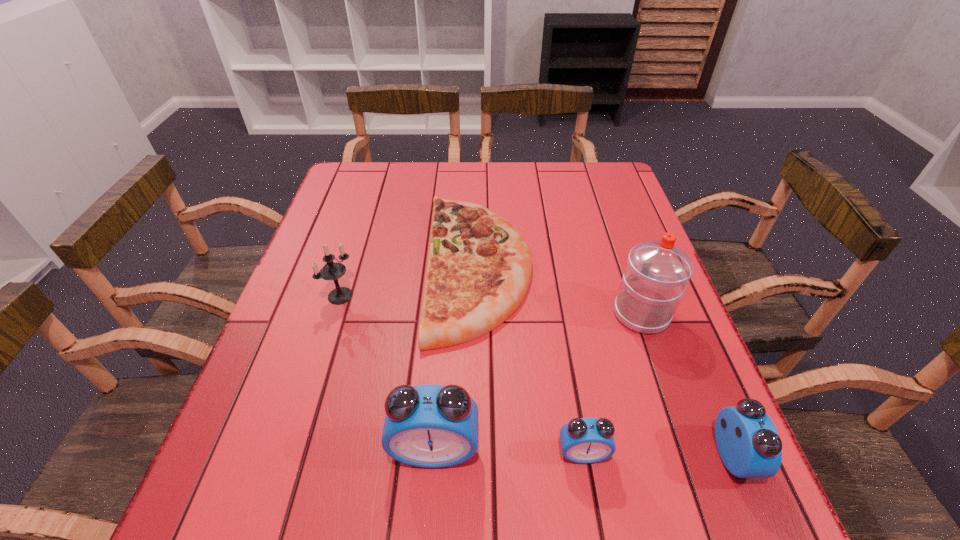
Given the evenly spaced alarm clocks in the image, where should an extra alarm clock be added on the left to preserve the spacing? Please point to a vacant space. Please provide its 2D coordinates. Your answer should be formatted as a tuple, i.e. [(x, y)], where the tuple contains the x and y coordinates of a point satisfying the conditions above.

[(289, 446)]